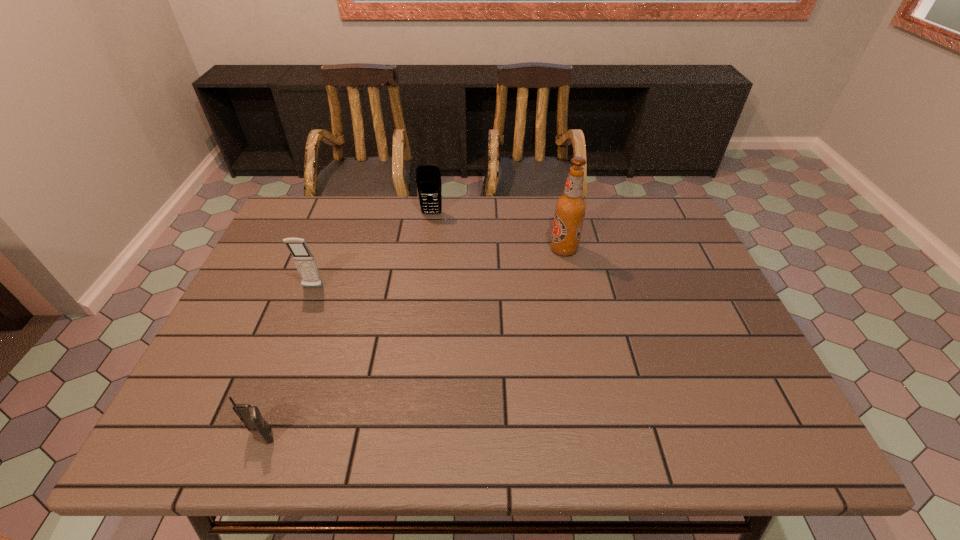
This screenshot has width=960, height=540. Identify the location of vacant space at the far left corner. (304, 207).

Where is `vacant area that lies between the nearest object and the second nearest object`? vacant area that lies between the nearest object and the second nearest object is located at coordinates (287, 362).

What are the coordinates of `vacant space in between the second nearest cellular telephone and the rightmost object` in the screenshot? It's located at (438, 268).

Locate an element on the screen. vacant region between the second nearest object and the shortest cellular telephone is located at coordinates (287, 362).

Identify the location of free space between the shortest cellular telephone and the farthest object. The height and width of the screenshot is (540, 960). (347, 325).

Where is `vacant area that lies between the second farthest object and the nearest object`? The height and width of the screenshot is (540, 960). vacant area that lies between the second farthest object and the nearest object is located at coordinates (413, 343).

You are a GUI agent. You are given a task and a screenshot of the screen. Output one action in this format:
    pyautogui.click(x=<x>, y=<y>)
    Task: Click on the blank region between the second object from right to left and the shortest object
    
    Given the screenshot: What is the action you would take?
    pyautogui.click(x=347, y=325)

Where is `free space that is in between the second nearest cellular telephone and the farthest object`? free space that is in between the second nearest cellular telephone and the farthest object is located at coordinates (372, 251).

What are the coordinates of `free spot between the rightmost cellular telephone and the nearest object` in the screenshot? It's located at (347, 325).

Where is `vacant space in between the second nearest cellular telephone and the farthest object`? Image resolution: width=960 pixels, height=540 pixels. vacant space in between the second nearest cellular telephone and the farthest object is located at coordinates (372, 251).